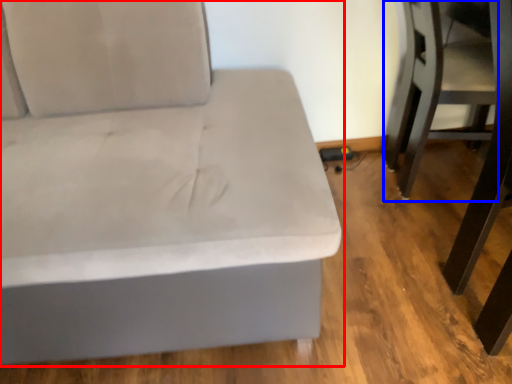
Question: Which object appears closest to the camera in this image, studio couch (highlighted by a red box) or swivel chair (highlighted by a blue box)?

Choices:
 (A) studio couch
 (B) swivel chair

Answer: (A)